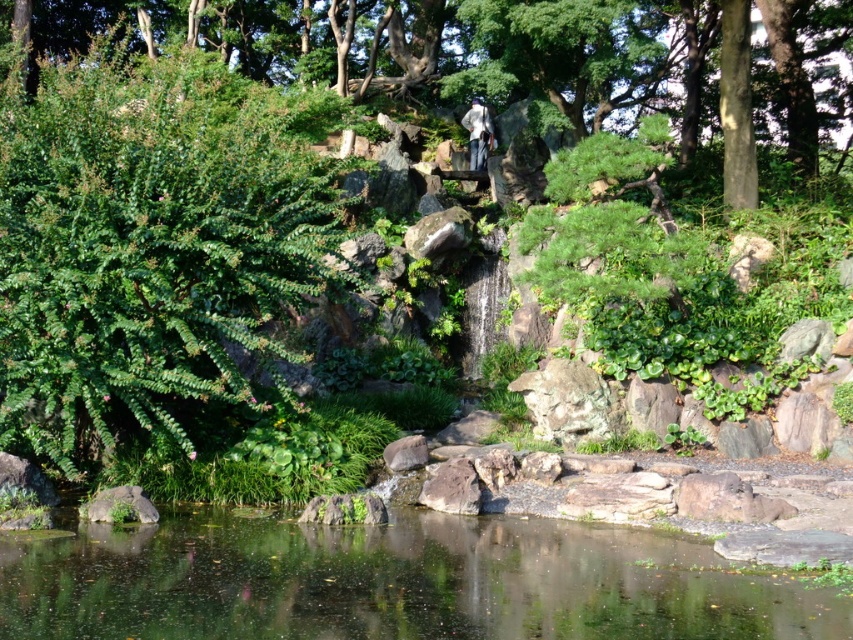
You are a visitor in the garden and want to place a small decorative item on the transparent water at center and the white fabric at center. Which surface allows placing the item without it sinking?

The white fabric at center allows placing the item without it sinking because it occupies more space than the transparent water at center, providing better support.

You are standing in the garden and want to place a small decorative stone between the two points, point (465, 60) and point (479, 140). Which point should the stone be closer to in order to be placed behind the waterfall?

The stone should be placed closer to point (465, 60) because it is behind point (479, 140), so placing it near that point would position it behind the waterfall.

You are standing in the garden and want to place a small decorative stone between the green leafy tree at upper center and the white fabric at center. Based on their positions, which object should the stone be closer to?

The green leafy tree at upper center is positioned on the left side of white fabric at center, so the stone should be placed closer to the green leafy tree at upper center to be between them.